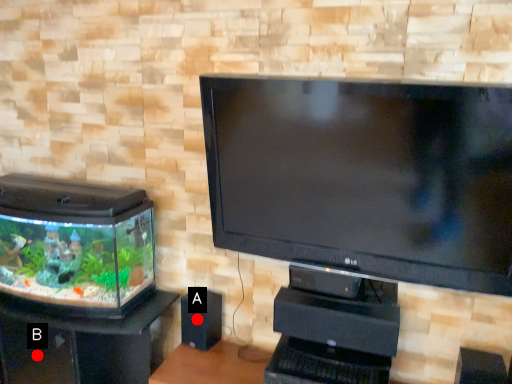
Question: Two points are circled on the image, labeled by A and B beside each circle. Which point appears closest to the camera in this image?

Choices:
 (A) A is closer
 (B) B is closer

Answer: (B)